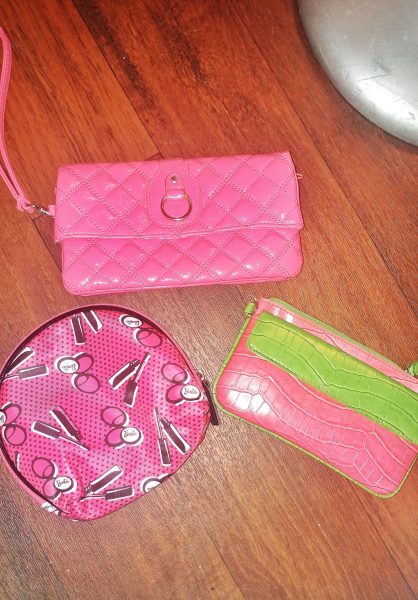
The width and height of the screenshot is (418, 600). What are the coordinates of `wooden surface` in the screenshot? It's located at [x=262, y=524].